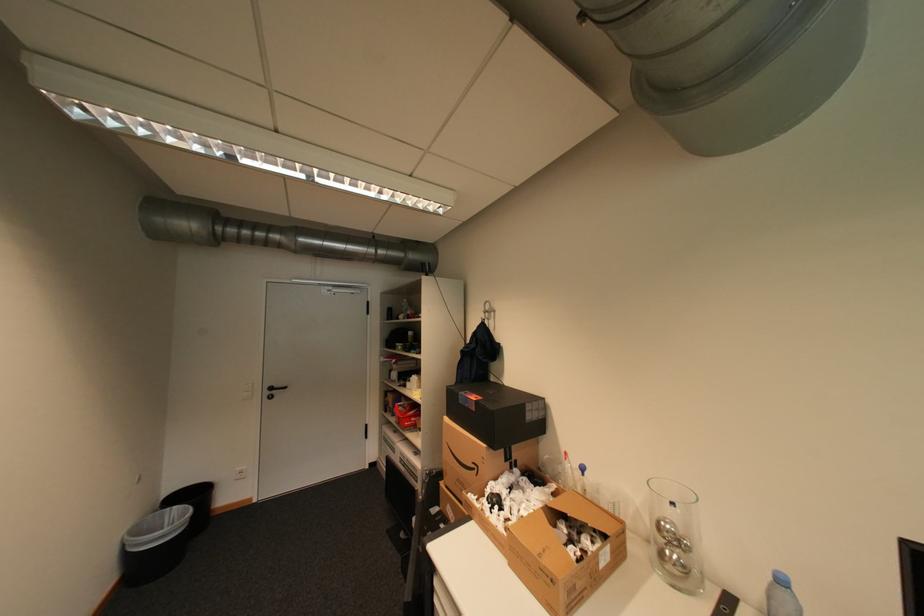
Find where to pull the black door handle. Please return your answer as a coordinate pair (x, y).

(274, 391)